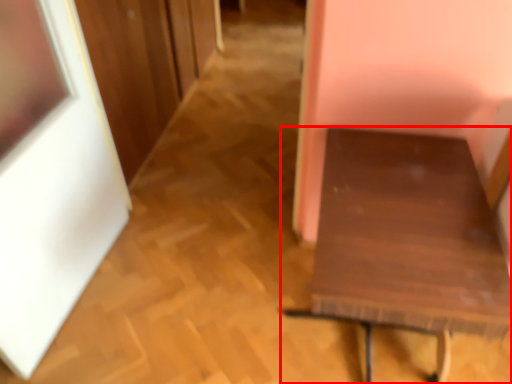
Question: From the image's perspective, considering the relative positions of furniture (annotated by the red box) and picture frame in the image provided, where is furniture (annotated by the red box) located with respect to the staircase?

Choices:
 (A) above
 (B) below

Answer: (B)